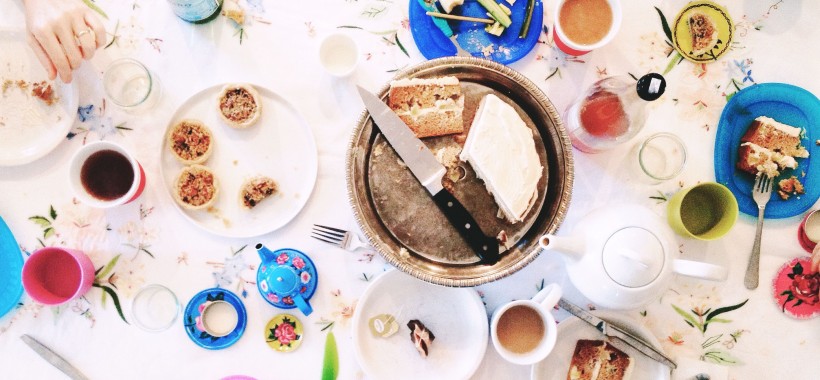
Find the location of `cup`. cup is located at coordinates (593, 39).